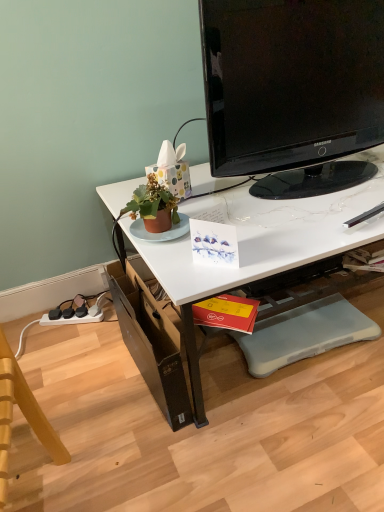
What do you see at coordinates (293, 91) in the screenshot?
I see `black glossy television at upper center` at bounding box center [293, 91].

In order to face black glossy television at upper center, should I rotate leftwards or rightwards?

Rotate right and turn 16.874 degrees.

Describe the element at coordinates (150, 340) in the screenshot. I see `brown cardboard drawer at lower left` at that location.

The height and width of the screenshot is (512, 384). I want to click on black glossy television at upper center, so click(x=293, y=91).

Which is nearer, (57, 464) or (333, 45)?

Point (57, 464) appears to be closer to the viewer than point (333, 45).

Is wooden swivel chair at lower left directly adjacent to black glossy television at upper center?

No, wooden swivel chair at lower left is not with black glossy television at upper center.

Between wooden swivel chair at lower left and black glossy television at upper center, which one has less height?

black glossy television at upper center.

From a real-world perspective, is brown cardboard drawer at lower left over white glossy desk at upper center?

No, from a real-world perspective, brown cardboard drawer at lower left is not over white glossy desk at upper center

Is brown cardboard drawer at lower left facing away from white glossy desk at upper center?

That's right, brown cardboard drawer at lower left is facing away from white glossy desk at upper center.

From the image's perspective, which is below, brown cardboard drawer at lower left or white glossy desk at upper center?

brown cardboard drawer at lower left, from the image's perspective.

Considering the positions of points (126, 339) and (259, 223), is point (126, 339) farther from camera compared to point (259, 223)?

Yes, it is.

Is red matte book at lower center oriented towards white glossy desk at upper center?

Yes, red matte book at lower center is facing white glossy desk at upper center.

Image resolution: width=384 pixels, height=512 pixels. I want to click on book that appears below the white glossy desk at upper center (from a real-world perspective), so click(227, 313).

Considering the relative sizes of red matte book at lower center and white glossy desk at upper center in the image provided, is red matte book at lower center thinner than white glossy desk at upper center?

Yes.

Based on their positions, is red matte book at lower center located to the left or right of white glossy desk at upper center?

red matte book at lower center is positioned on white glossy desk at upper center's left side.

Which object is wider, black glossy television at upper center or brown cardboard drawer at lower left?

black glossy television at upper center is wider.

From a real-world perspective, between black glossy television at upper center and brown cardboard drawer at lower left, who is vertically higher?

black glossy television at upper center, from a real-world perspective.

In order to click on drawer that is on the left side of black glossy television at upper center in this screenshot , I will do `click(150, 340)`.

Consider the image. Which point is more forward, (x=283, y=94) or (x=172, y=381)?

The point (x=172, y=381) is closer to the camera.

Is point (6, 346) more distant than point (259, 330)?

That is False.

Is wooden swivel chair at lower left not inside gray rubber footrest at lower center?

Indeed, wooden swivel chair at lower left is completely outside gray rubber footrest at lower center.

From the picture: Is wooden swivel chair at lower left far away from gray rubber footrest at lower center?

They are positioned close to each other.

From a real-world perspective, which object stands above the other?

In real-world perspective, wooden swivel chair at lower left is above.

Is white glossy desk at upper center next to wooden swivel chair at lower left and touching it?

No, white glossy desk at upper center is not in contact with wooden swivel chair at lower left.

Could you tell me if white glossy desk at upper center is turned towards wooden swivel chair at lower left?

No, white glossy desk at upper center is not oriented towards wooden swivel chair at lower left.

Considering the sizes of objects white glossy desk at upper center and wooden swivel chair at lower left in the image provided, who is shorter, white glossy desk at upper center or wooden swivel chair at lower left?

white glossy desk at upper center.

Is point (370, 240) closer or farther from the camera than point (9, 438)?

Point (370, 240) is positioned farther from the camera compared to point (9, 438).

Considering the sizes of objects gray rubber footrest at lower center and red matte book at lower center in the image provided, who is shorter, gray rubber footrest at lower center or red matte book at lower center?

Standing shorter between the two is red matte book at lower center.

From the image's perspective, relative to red matte book at lower center, is gray rubber footrest at lower center above or below?

gray rubber footrest at lower center is situated lower than red matte book at lower center in the image.

Is gray rubber footrest at lower center not near red matte book at lower center?

No, there isn't a large distance between gray rubber footrest at lower center and red matte book at lower center.

Considering the sizes of objects gray rubber footrest at lower center and red matte book at lower center in the image provided, who is bigger, gray rubber footrest at lower center or red matte book at lower center?

Bigger between the two is gray rubber footrest at lower center.

The height and width of the screenshot is (512, 384). I want to click on swivel chair below the black glossy television at upper center (from a real-world perspective), so click(23, 413).

The width and height of the screenshot is (384, 512). Identify the location of drawer on the left of white glossy desk at upper center. (150, 340).

When comparing their distances from white glossy desk at upper center, does black glossy television at upper center or gray rubber footrest at lower center seem closer?

Among the two, black glossy television at upper center is located nearer to white glossy desk at upper center.

Based on their spatial positions, is red matte book at lower center or brown cardboard drawer at lower left further from black glossy television at upper center?

Among the two, brown cardboard drawer at lower left is located further to black glossy television at upper center.

Based on their spatial positions, is white glossy desk at upper center or black glossy television at upper center further from gray rubber footrest at lower center?

black glossy television at upper center lies further to gray rubber footrest at lower center than the other object.

Which object lies nearer to the anchor point red matte book at lower center, gray rubber footrest at lower center or brown cardboard drawer at lower left?

brown cardboard drawer at lower left.

Based on their spatial positions, is white glossy desk at upper center or black glossy television at upper center further from red matte book at lower center?

black glossy television at upper center lies further to red matte book at lower center than the other object.

Which object lies further to the anchor point black glossy television at upper center, gray rubber footrest at lower center or white glossy desk at upper center?

Based on the image, gray rubber footrest at lower center appears to be further to black glossy television at upper center.

Looking at the image, which one is located closer to red matte book at lower center, gray rubber footrest at lower center or white glossy desk at upper center?

gray rubber footrest at lower center is positioned closer to the anchor red matte book at lower center.

Looking at the image, which one is located further to gray rubber footrest at lower center, red matte book at lower center or white glossy desk at upper center?

white glossy desk at upper center lies further to gray rubber footrest at lower center than the other object.

Identify the location of desk between black glossy television at upper center and red matte book at lower center in the up-down direction. The image size is (384, 512). (259, 247).

Identify the location of drawer between wooden swivel chair at lower left and white glossy desk at upper center. Image resolution: width=384 pixels, height=512 pixels. (150, 340).

You are a GUI agent. You are given a task and a screenshot of the screen. Output one action in this format:
    pyautogui.click(x=<x>, y=<y>)
    Task: Click on the footrest between black glossy television at upper center and brown cardboard drawer at lower left vertically
    The height and width of the screenshot is (512, 384).
    Given the screenshot: What is the action you would take?
    pyautogui.click(x=304, y=334)

The image size is (384, 512). Identify the location of book between black glossy television at upper center and brown cardboard drawer at lower left in the vertical direction. (227, 313).